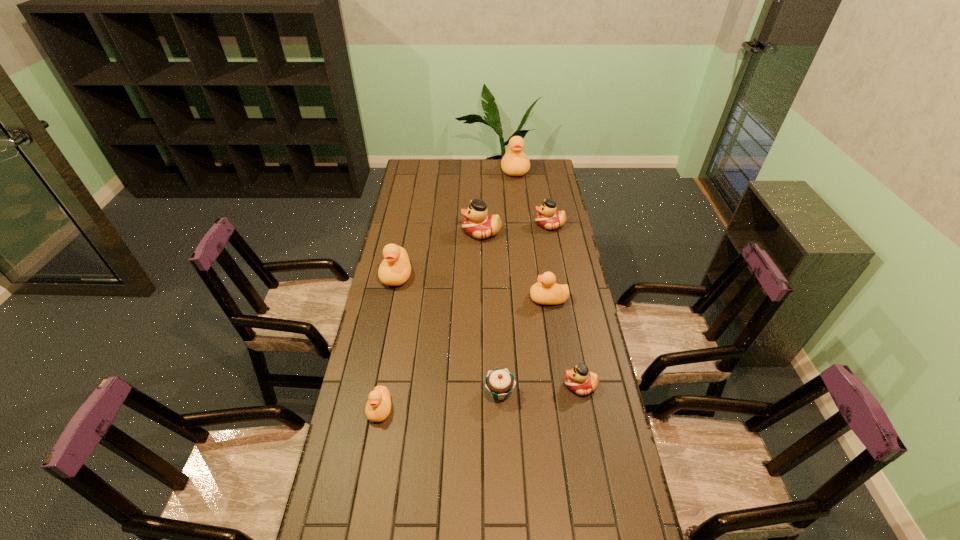
At what (x,y) coordinates should I click in order to perform the action: click on vacant point located on the face of the third biggest yellow duck. Please return your answer as a coordinate pair (x, y). This screenshot has height=540, width=960. Looking at the image, I should click on (462, 299).

Image resolution: width=960 pixels, height=540 pixels. What are the coordinates of `free space located on the face of the nearest red duck` in the screenshot? It's located at 523,386.

Identify the location of vacant area located 0.240m on the face of the nearest red duck. This screenshot has height=540, width=960. (489, 386).

Where is `vacant space located on the face of the nearest red duck`? The height and width of the screenshot is (540, 960). vacant space located on the face of the nearest red duck is located at coordinates (533, 386).

The image size is (960, 540). I want to click on vacant area situated on the front of the teal cupcake, so (x=505, y=536).

At what (x,y) coordinates should I click in order to perform the action: click on free space located on the face of the smallest yellow duck. Please return your answer as a coordinate pair (x, y). This screenshot has height=540, width=960. Looking at the image, I should click on (358, 532).

At what (x,y) coordinates should I click in order to perform the action: click on object that is positioned at the far edge. Please return your answer as a coordinate pair (x, y). Looking at the image, I should click on (515, 162).

In order to click on object that is at the far right corner in this screenshot , I will do `click(515, 162)`.

This screenshot has width=960, height=540. Find the location of `vacant space at the far edge of the desktop`. vacant space at the far edge of the desktop is located at coordinates (496, 161).

You are a GUI agent. You are given a task and a screenshot of the screen. Output one action in this format:
    pyautogui.click(x=<x>, y=<y>)
    Task: Click on the vacant area at the left edge of the desktop
    The width and height of the screenshot is (960, 540).
    Given the screenshot: What is the action you would take?
    coord(331,489)